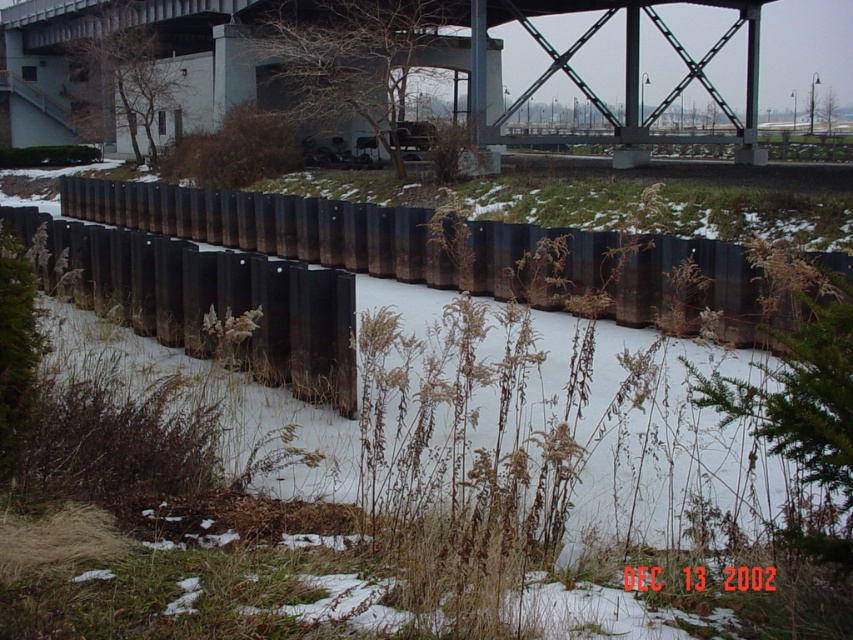
Is rusty metal fence at center to the right of metallic gray bridge at upper center from the viewer's perspective?

No, rusty metal fence at center is not to the right of metallic gray bridge at upper center.

Which is in front, point (335, 244) or point (67, 51)?

Point (335, 244) is more forward.

Where is `rusty metal fence at center`? The width and height of the screenshot is (853, 640). rusty metal fence at center is located at coordinates (219, 241).